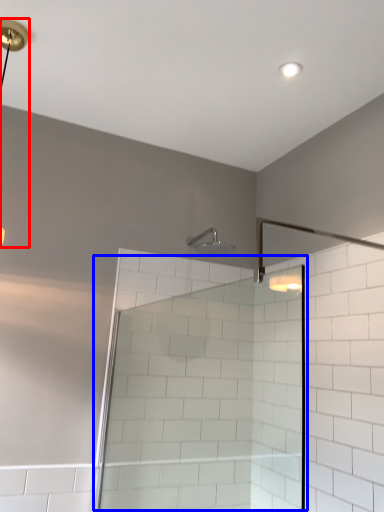
Question: Which point is further to the camera, lamp (highlighted by a red box) or screen door (highlighted by a blue box)?

Choices:
 (A) lamp
 (B) screen door

Answer: (A)